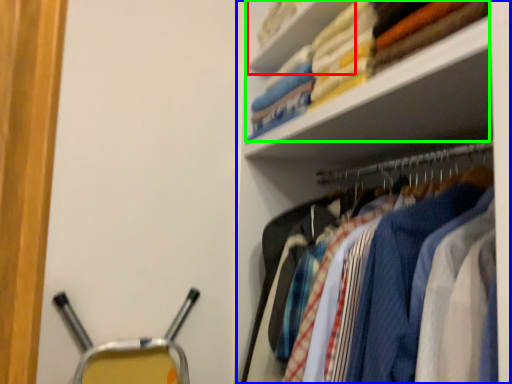
Question: Estimate the real-world distances between objects in this image. Which object is closer to cabinet (highlighted by a red box), shelf (highlighted by a blue box) or laundry (highlighted by a green box)?

Choices:
 (A) shelf
 (B) laundry

Answer: (B)